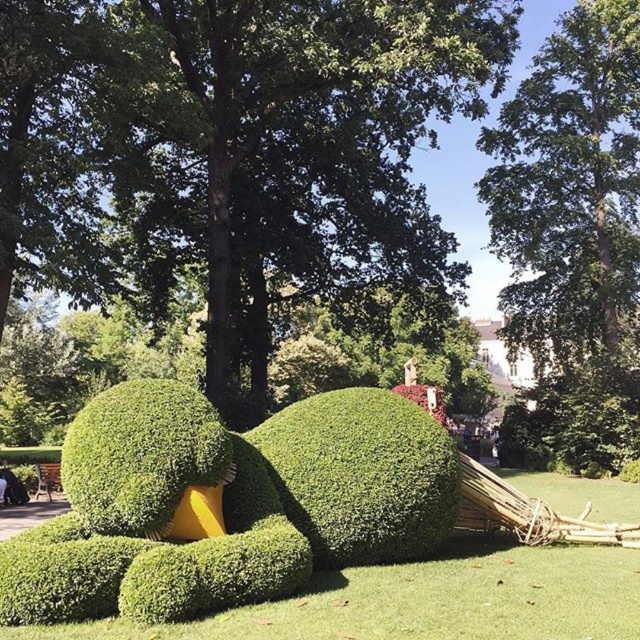
Between green leafy tree at center and green leafy tree at upper center, which one is positioned lower?

green leafy tree at center is below.

How distant is green leafy tree at center from green leafy tree at upper center?

They are 24.54 feet apart.

Find the location of a particular element. This screenshot has height=640, width=640. green leafy tree at center is located at coordinates (234, 148).

Which is behind, point (525, 346) or point (92, 454)?

The point (525, 346) is behind.

Identify the location of green leafy tree at upper center. The width and height of the screenshot is (640, 640). (570, 182).

Is green grass at center taller than green leafy bush at center?

Indeed, green grass at center has a greater height compared to green leafy bush at center.

Does point (64, 636) come farther from viewer compared to point (376, 513)?

No, (64, 636) is in front of (376, 513).

Measure the distance between point (512, 554) and camera.

6.63 meters

At what (x,y) coordinates should I click in order to perform the action: click on green grass at center. Please return your answer as a coordinate pair (x, y). Looking at the image, I should click on (426, 600).